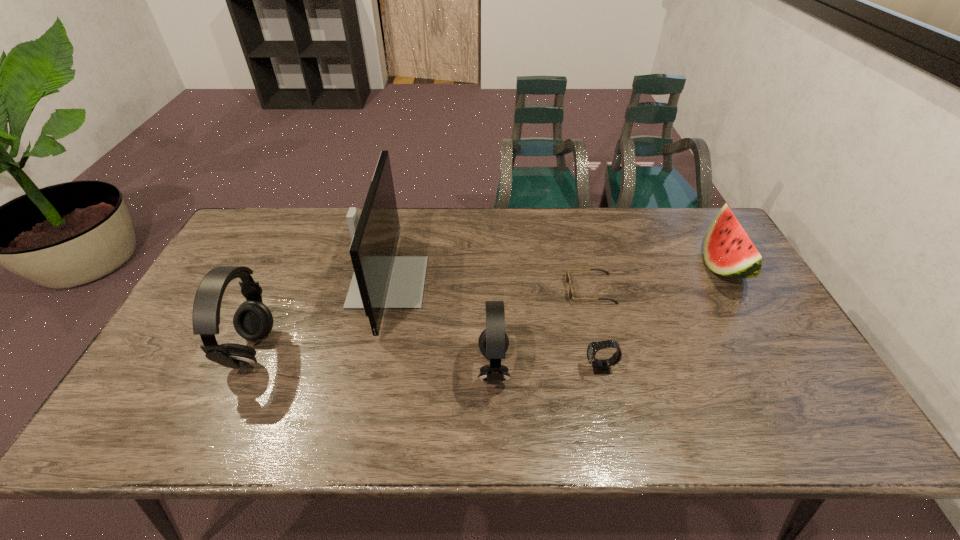
Find the location of a particular element. The width and height of the screenshot is (960, 540). free space located 0.120m on the ear cups of the leftmost object is located at coordinates (187, 349).

Identify the location of vacant space positioned on the ear cups of the leftmost object. (199, 349).

Image resolution: width=960 pixels, height=540 pixels. Find the location of `free space located 0.060m on the ear cups of the shorter earphone`. free space located 0.060m on the ear cups of the shorter earphone is located at coordinates point(454,368).

The image size is (960, 540). I want to click on free space located 0.300m on the ear cups of the shorter earphone, so click(x=357, y=368).

At what (x,y) coordinates should I click in order to perform the action: click on vacant region located 0.070m on the ear cups of the shorter earphone. Please return your answer as a coordinate pair (x, y). Looking at the image, I should click on (450, 368).

At what (x,y) coordinates should I click in order to perform the action: click on free spot located on the front-facing side of the shortest object. Please return your answer as a coordinate pair (x, y). Looking at the image, I should click on (516, 289).

Find the location of a particular element. vacant space situated 0.140m on the front-facing side of the shortest object is located at coordinates (519, 289).

Identify the location of vacant space located 0.210m on the front-facing side of the shortest object. (495, 289).

The height and width of the screenshot is (540, 960). Find the location of `vacant area located on the screen of the fifth object from right to left`. vacant area located on the screen of the fifth object from right to left is located at coordinates (465, 282).

Where is `vacant position located 0.100m on the outer rind of the third shortest object`? This screenshot has height=540, width=960. vacant position located 0.100m on the outer rind of the third shortest object is located at coordinates (671, 266).